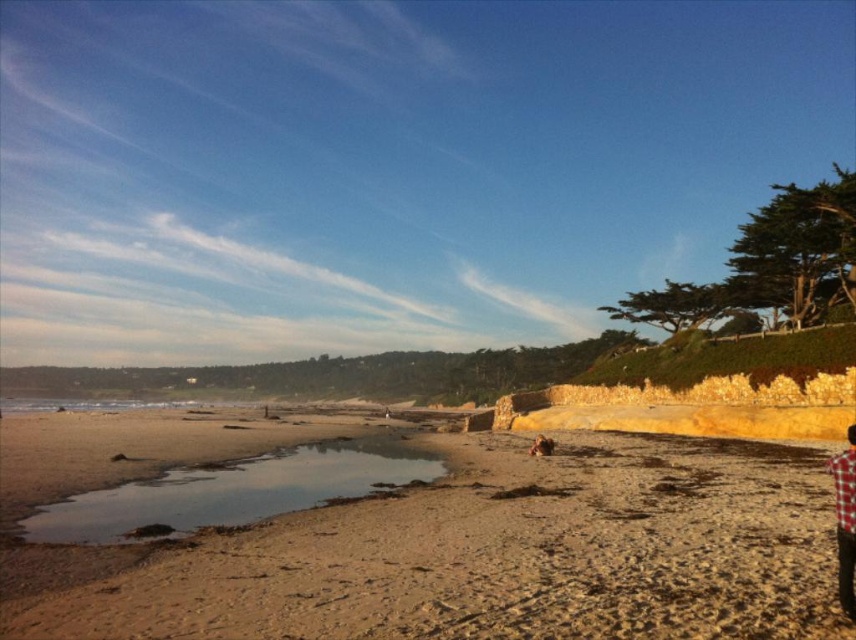
Question: Is brown sandy beach at lower left above brown fur dog at center?

Choices:
 (A) yes
 (B) no

Answer: (A)

Question: Which object is the closest to the brown fur dog at center?

Choices:
 (A) brown sandy beach at lower left
 (B) plaid fabric shirt at lower right

Answer: (A)

Question: Estimate the real-world distances between objects in this image. Which object is farther from the brown sandy beach at lower left?

Choices:
 (A) plaid fabric shirt at lower right
 (B) brown fur dog at center

Answer: (A)

Question: Is brown sandy beach at lower left above brown fur dog at center?

Choices:
 (A) yes
 (B) no

Answer: (A)

Question: Can you confirm if brown sandy beach at lower left is positioned to the right of brown fur dog at center?

Choices:
 (A) no
 (B) yes

Answer: (A)

Question: Which object appears farthest from the camera in this image?

Choices:
 (A) brown fur dog at center
 (B) plaid fabric shirt at lower right

Answer: (A)